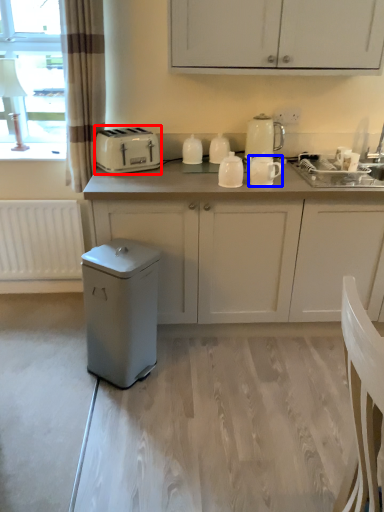
Question: Which object is further to the camera taking this photo, toaster (highlighted by a red box) or kitchen appliance (highlighted by a blue box)?

Choices:
 (A) toaster
 (B) kitchen appliance

Answer: (A)